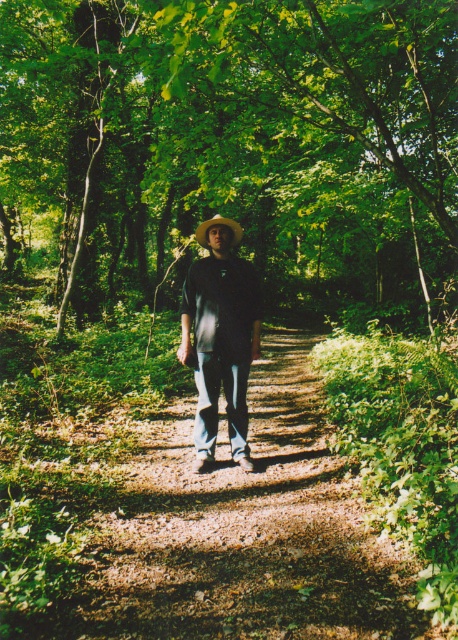
Is green leafy tree at center wider than brown straw cowboy hat at center?

Correct, the width of green leafy tree at center exceeds that of brown straw cowboy hat at center.

Does point (5, 6) lie behind point (239, 241)?

Yes, point (5, 6) is farther from viewer.

Which is in front, point (414, 100) or point (235, 221)?

Point (414, 100) is in front.

Where is `green leafy tree at center`? The width and height of the screenshot is (458, 640). green leafy tree at center is located at coordinates (234, 148).

Does green leafy tree at center appear on the left side of matte black shirt at center?

Yes, green leafy tree at center is to the left of matte black shirt at center.

Does green leafy tree at center come in front of matte black shirt at center?

That is True.

Image resolution: width=458 pixels, height=640 pixels. I want to click on green leafy tree at center, so click(234, 148).

Measure the distance from matte black shirt at center to brown straw cowboy hat at center.

matte black shirt at center and brown straw cowboy hat at center are 33.52 inches apart.

Is point (230, 406) less distant than point (235, 230)?

No, (230, 406) is further to viewer.

Image resolution: width=458 pixels, height=640 pixels. Identify the location of matte black shirt at center. (221, 337).

The height and width of the screenshot is (640, 458). Identify the location of matte black shirt at center. (221, 337).